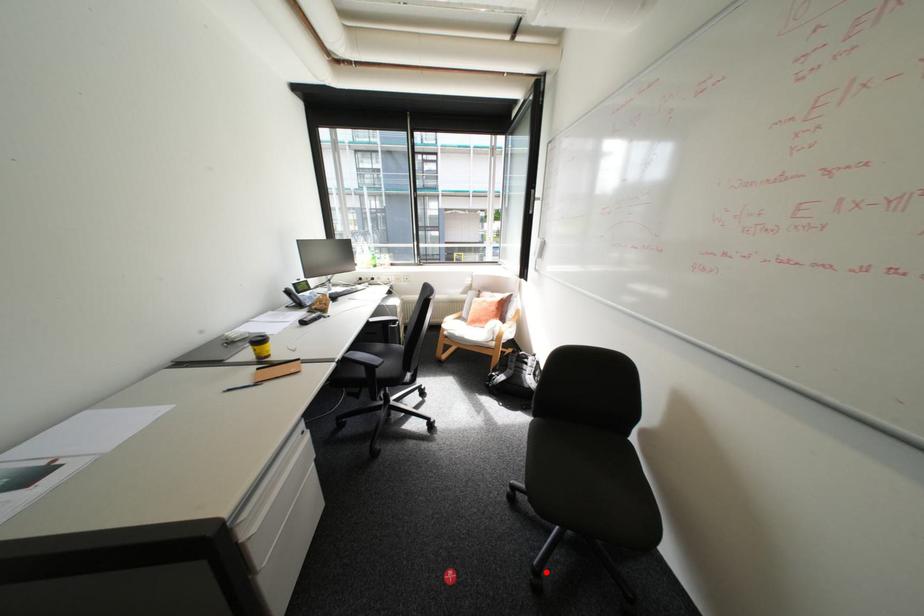
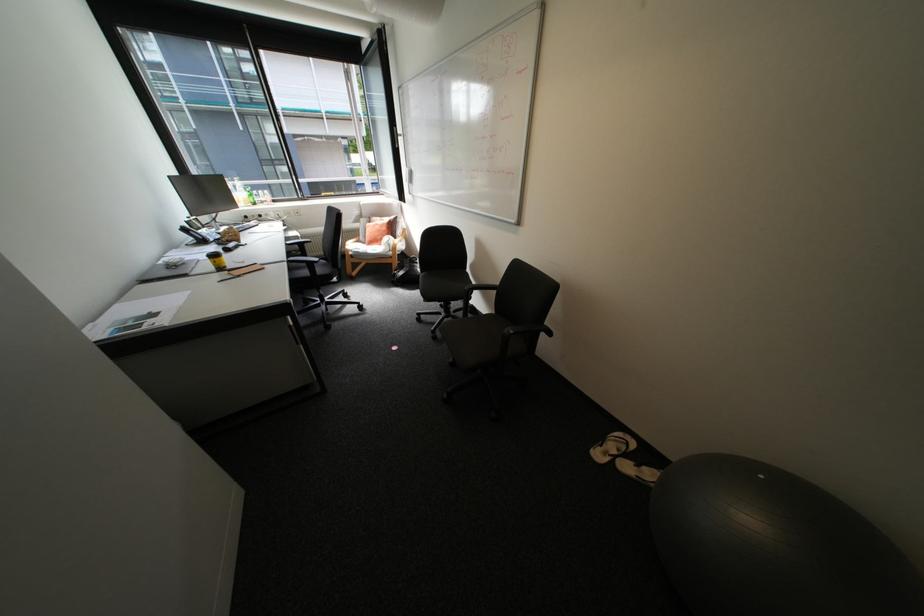
In the second image, find the point that corresponds to the highlighted location in the first image.

(444, 331)